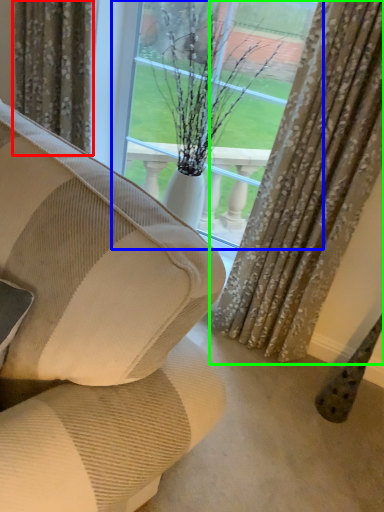
Question: Which is nearer to the curtain (highlighted by a red box)? window (highlighted by a blue box) or curtain (highlighted by a green box).

Choices:
 (A) window
 (B) curtain

Answer: (A)